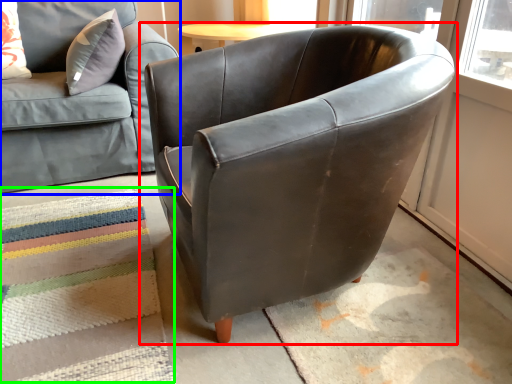
Question: Which object is the closest to the chair (highlighted by a red box)? Choose among these: studio couch (highlighted by a blue box) or mat (highlighted by a green box).

Choices:
 (A) studio couch
 (B) mat

Answer: (B)